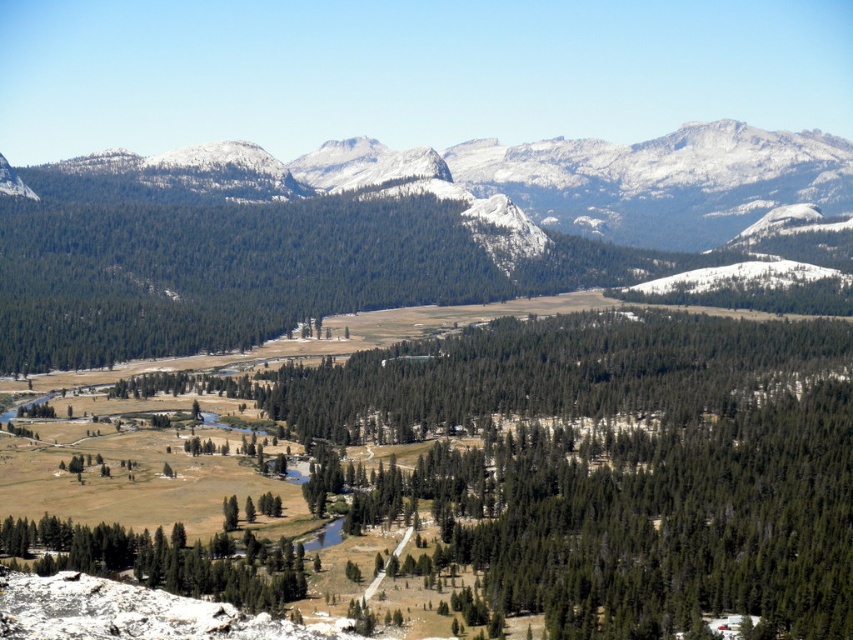
Question: Is the position of snowy granite mountains at upper center more distant than that of green matte tree at lower left?

Choices:
 (A) yes
 (B) no

Answer: (A)

Question: Is snowy granite mountains at upper center bigger than green matte tree at lower left?

Choices:
 (A) no
 (B) yes

Answer: (B)

Question: Which object is farther from the camera taking this photo?

Choices:
 (A) snowy granite mountains at upper center
 (B) green matte tree at lower left

Answer: (A)

Question: Does snowy granite mountains at upper center have a greater width compared to green matte tree at lower left?

Choices:
 (A) yes
 (B) no

Answer: (A)